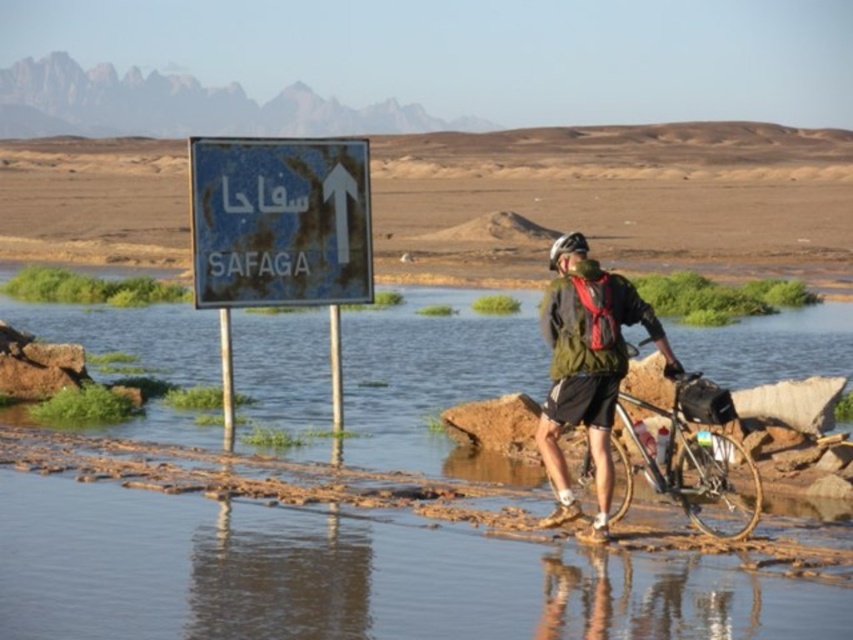
Question: Does desert at upper center have a larger size compared to white matte bicycle helmet at center?

Choices:
 (A) no
 (B) yes

Answer: (B)

Question: Does desert at upper center have a larger size compared to shiny metallic bicycle at center?

Choices:
 (A) no
 (B) yes

Answer: (B)

Question: Among these objects, which one is nearest to the camera?

Choices:
 (A) blue plastic sign at upper center
 (B) white matte bicycle helmet at center
 (C) green matte jacket at center

Answer: (C)

Question: Is blue plastic sign at upper center further to camera compared to white matte bicycle helmet at center?

Choices:
 (A) yes
 (B) no

Answer: (A)

Question: Estimate the real-world distances between objects in this image. Which object is farther from the green matte jacket at center?

Choices:
 (A) blue plastic sign at upper center
 (B) white matte bicycle helmet at center
 (C) shiny metallic bicycle at center

Answer: (A)

Question: Estimate the real-world distances between objects in this image. Which object is closer to the shiny metallic bicycle at center?

Choices:
 (A) blue plastic sign at upper center
 (B) white matte bicycle helmet at center

Answer: (B)